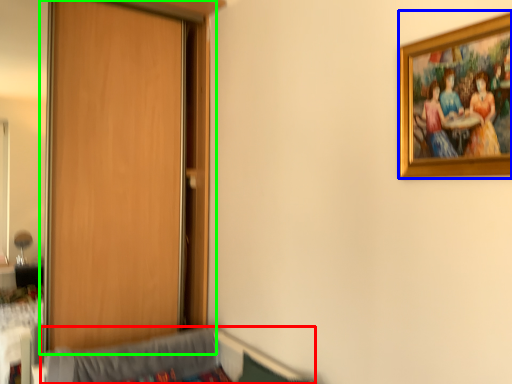
Question: Estimate the real-world distances between objects in this image. Which object is closer to hospital bed (highlighted by a red box), picture frame (highlighted by a blue box) or door (highlighted by a green box)?

Choices:
 (A) picture frame
 (B) door

Answer: (B)